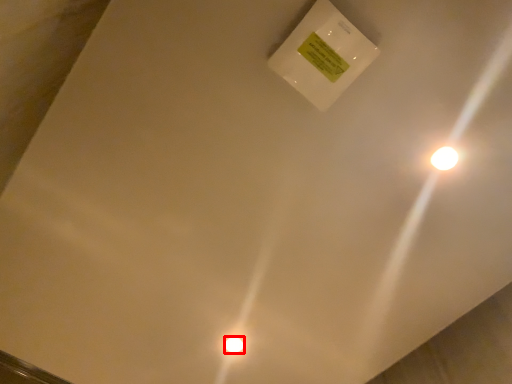
Question: From the image's perspective, what is the correct spatial positioning of light bulb (annotated by the red box) in reference to light?

Choices:
 (A) below
 (B) above

Answer: (A)